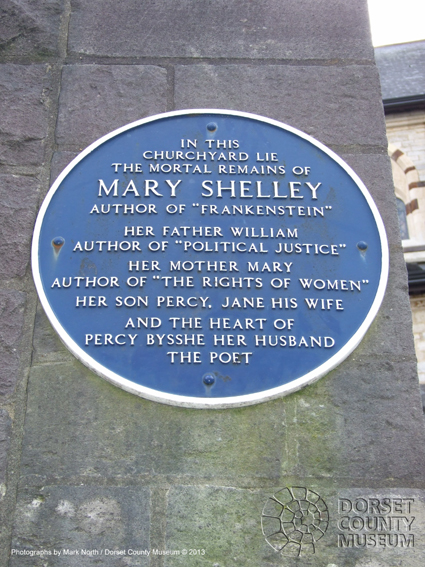
Where is `blue oval sign on wall`? The image size is (425, 567). blue oval sign on wall is located at coordinates (88, 224).